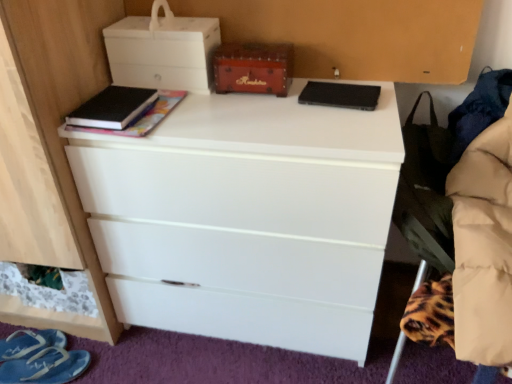
The image size is (512, 384). Find the location of `empty space that is in between black matte book at upper left, which ranks as the first book in left-to-right order, and black matte speaker at upper center, placed as the first book when sorted from right to left`. empty space that is in between black matte book at upper left, which ranks as the first book in left-to-right order, and black matte speaker at upper center, placed as the first book when sorted from right to left is located at coordinates pos(237,107).